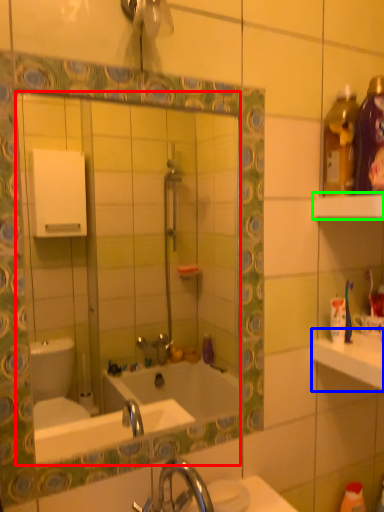
Question: Considering the real-world distances, which object is closest to mirror (highlighted by a red box)? counter top (highlighted by a blue box) or shelf (highlighted by a green box).

Choices:
 (A) counter top
 (B) shelf

Answer: (A)